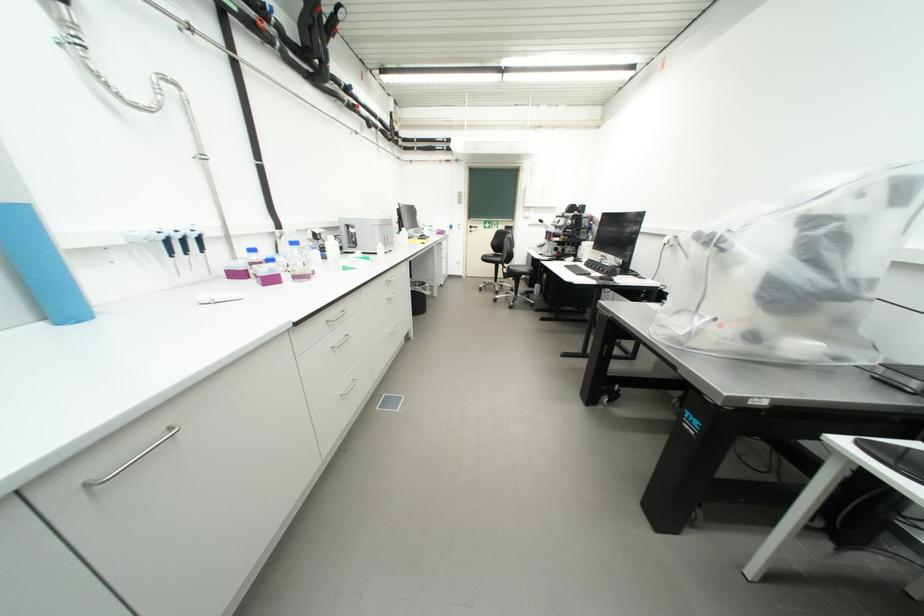
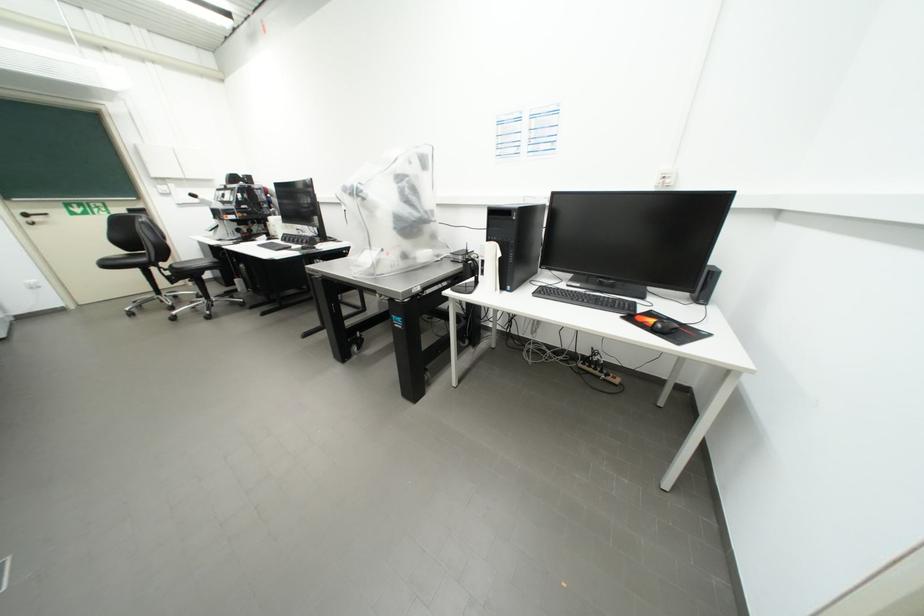
In the second image, find the point that corresponds to pixel 501 283 in the first image.

(160, 296)